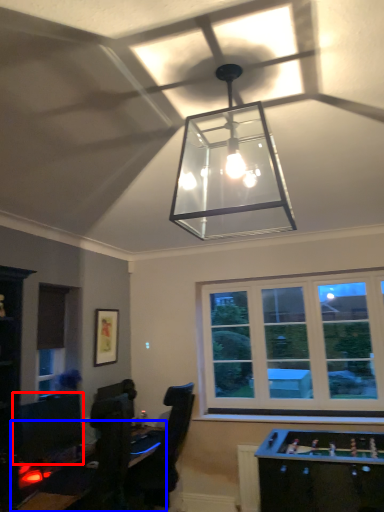
Question: Among these objects, which one is farthest to the camera, computer monitor (highlighted by a red box) or table (highlighted by a blue box)?

Choices:
 (A) computer monitor
 (B) table

Answer: (A)